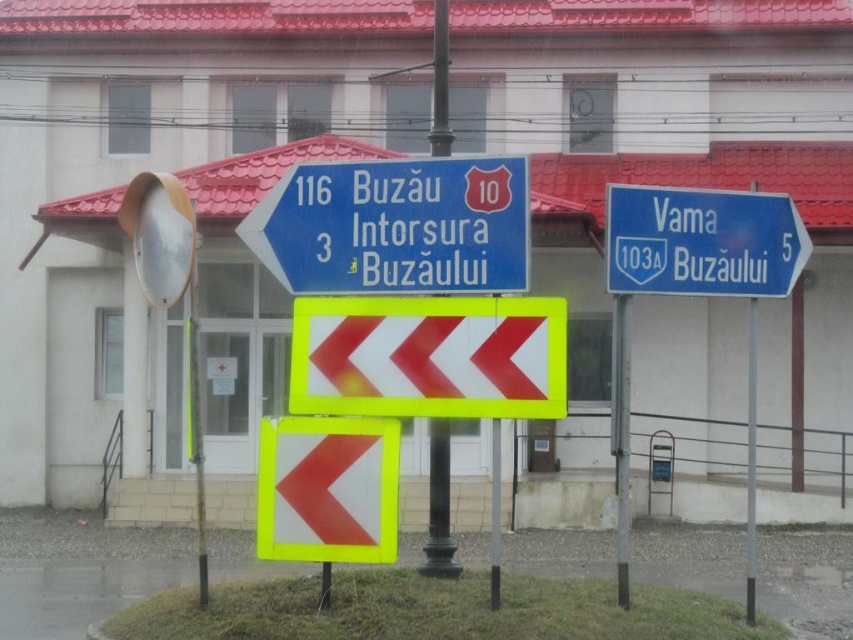
Who is positioned more to the right, blue plastic road sign at upper left or white reflective chevron at center?

white reflective chevron at center is more to the right.

From the picture: Between blue plastic road sign at upper left and white reflective chevron at center, which one is positioned higher?

Positioned higher is blue plastic road sign at upper left.

Where is `blue plastic road sign at upper left`? blue plastic road sign at upper left is located at coordinates (395, 227).

Does yellow reflective arrow at center appear under black metal pole at center?

Incorrect, yellow reflective arrow at center is not positioned below black metal pole at center.

Can you confirm if yellow reflective arrow at center is positioned to the right of black metal pole at center?

Incorrect, yellow reflective arrow at center is not on the right side of black metal pole at center.

I want to click on yellow reflective arrow at center, so click(x=328, y=490).

Is black metal pole at center bigger than metallic pole at center?

Correct, black metal pole at center is larger in size than metallic pole at center.

Can you confirm if black metal pole at center is shorter than metallic pole at center?

Yes.

What do you see at coordinates (439, 506) in the screenshot? I see `black metal pole at center` at bounding box center [439, 506].

Image resolution: width=853 pixels, height=640 pixels. Find the location of `black metal pole at center`. black metal pole at center is located at coordinates (439, 506).